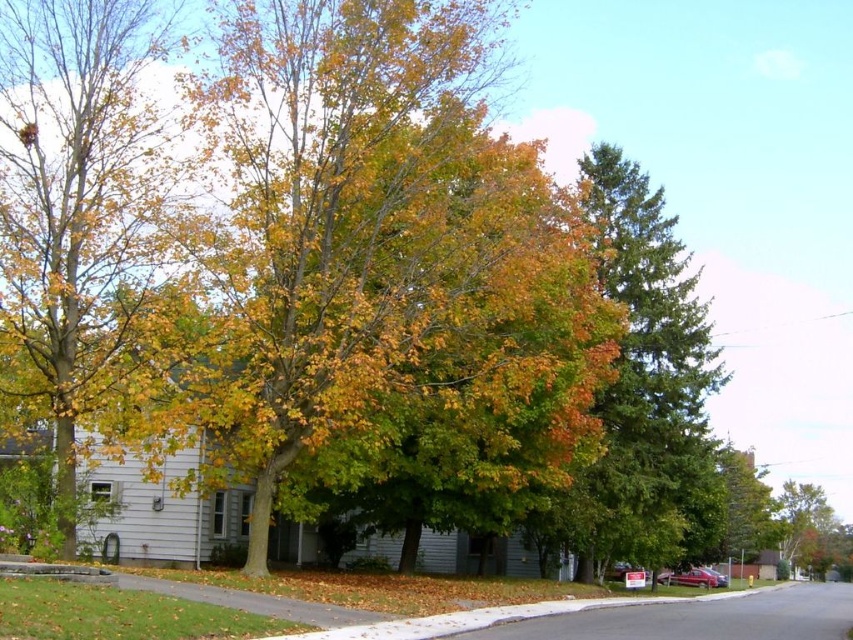
Question: Is yellow-green foliage at left further to camera compared to green textured tree at center?

Choices:
 (A) no
 (B) yes

Answer: (A)

Question: Can you confirm if green textured tree at center is wider than green leafy tree at lower right?

Choices:
 (A) no
 (B) yes

Answer: (B)

Question: Which of these objects is positioned closest to the green textured pine tree at center?

Choices:
 (A) yellow-green foliage at left
 (B) green leafy tree at lower right
 (C) green textured tree at center

Answer: (C)

Question: Which of the following is the closest to the observer?

Choices:
 (A) green leafy tree at lower right
 (B) green textured pine tree at center
 (C) green textured tree at center
 (D) yellow-green foliage at left

Answer: (D)

Question: Does yellow-green foliage at left appear under green leafy tree at lower right?

Choices:
 (A) no
 (B) yes

Answer: (A)

Question: Which is farther from the green textured tree at center?

Choices:
 (A) green leafy tree at lower right
 (B) green textured pine tree at center

Answer: (B)